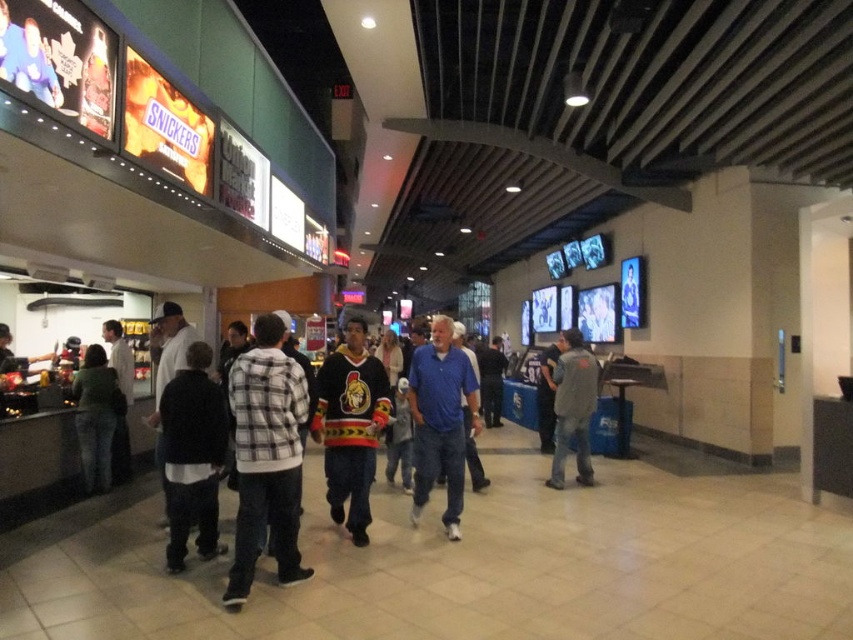
You are a customer carrying a large popcorn bucket and want to reach the counter. There is a black fleece jacket at center and a green cotton hoodie at center in your way. Can you walk between them without moving the jackets?

The distance between the black fleece jacket at center and the green cotton hoodie at center is 2.06 meters. Since the average person requires about 0.7 meters of space to walk through, you can easily walk between them without moving the jackets.